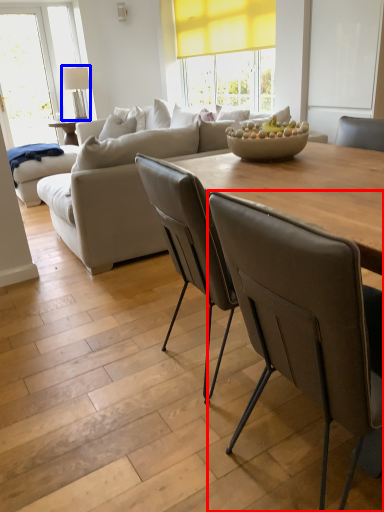
Question: Which point is further to the camera, chair (highlighted by a red box) or lamp (highlighted by a blue box)?

Choices:
 (A) chair
 (B) lamp

Answer: (B)